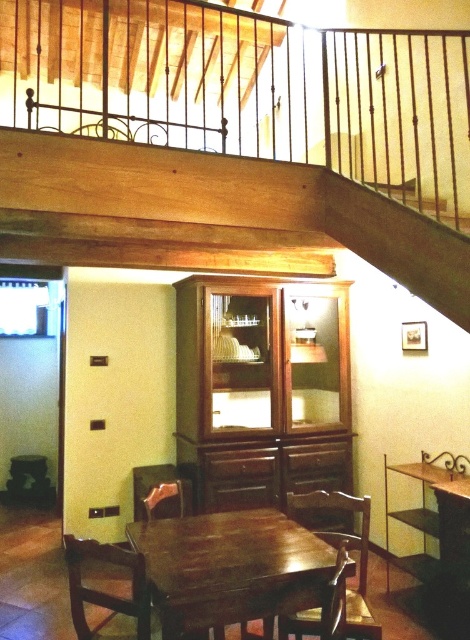
Question: Which of the following is the farthest from the observer?

Choices:
 (A) wooden table at center
 (B) brown wooden chair at lower left
 (C) wooden chair at lower left
 (D) wooden chair at lower center

Answer: (C)

Question: Considering the real-world distances, which object is closest to the brown wooden chair at lower left?

Choices:
 (A) wooden chair at lower center
 (B) wooden at upper center
 (C) wooden chair at lower left

Answer: (C)

Question: Is wooden table at center to the left of wooden chair at lower left from the viewer's perspective?

Choices:
 (A) no
 (B) yes

Answer: (A)

Question: Can you confirm if wooden at upper center is bigger than brown wooden chair at lower left?

Choices:
 (A) no
 (B) yes

Answer: (B)

Question: Which of these objects is positioned closest to the wooden table at center?

Choices:
 (A) wooden at upper center
 (B) brown wooden chair at lower left

Answer: (B)

Question: Observing the image, what is the correct spatial positioning of wooden at upper center in reference to wooden table at center?

Choices:
 (A) below
 (B) above

Answer: (B)